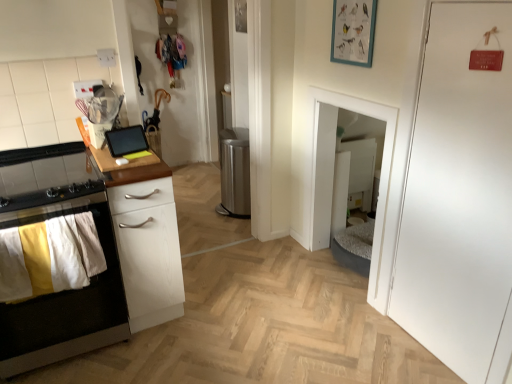
Locate an element on the screen. vacant area to the left of white matte door at right is located at coordinates (373, 345).